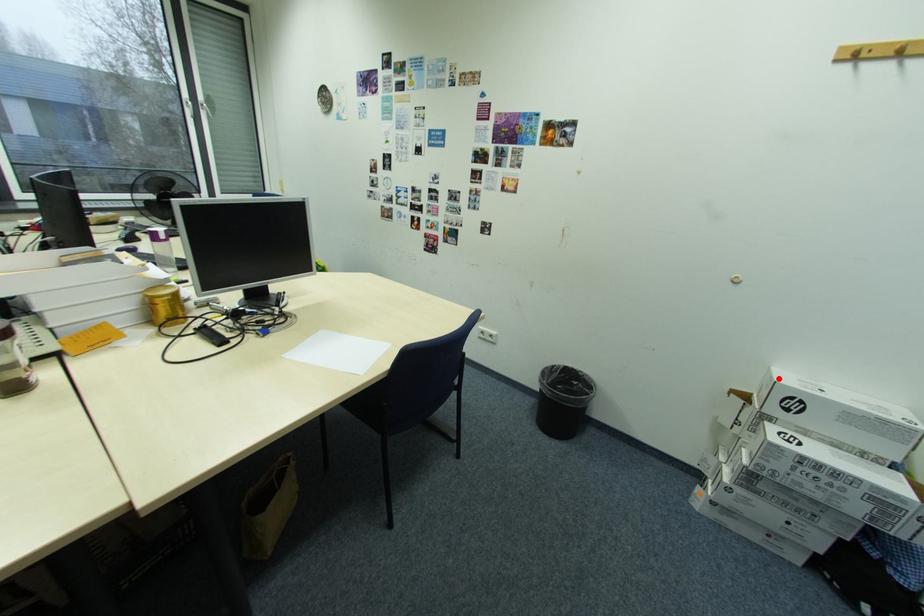
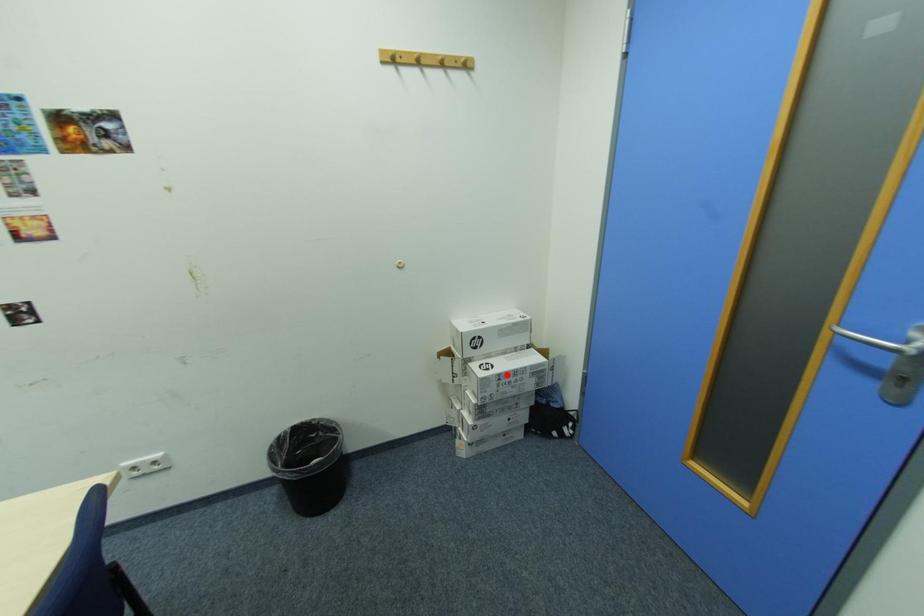
I am providing you with two images of the same scene from different viewpoints. A red point is marked on the first image and another point is marked on the second image. Is the red point in image1 aligned with the point shown in image2?

No